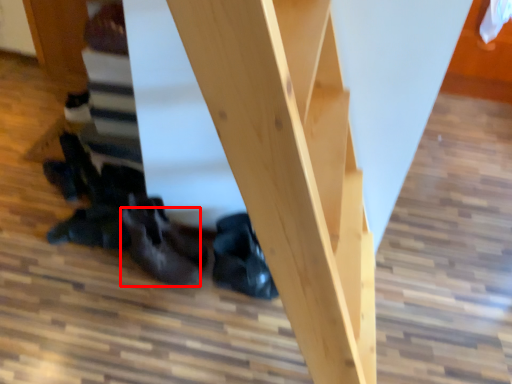
Question: From the image's perspective, where is leather shoe (annotated by the red box) located in relation to leather shoe in the image?

Choices:
 (A) above
 (B) below

Answer: (B)